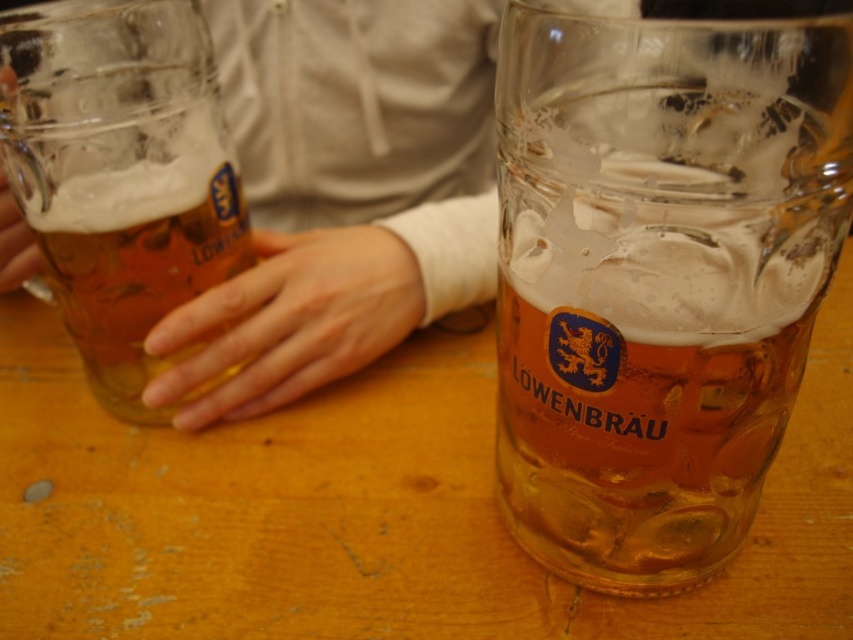
Question: Which object is farther from the camera taking this photo?

Choices:
 (A) matte skin hand at left
 (B) translucent glass mug at left
 (C) white fabric hand at center

Answer: (C)

Question: Considering the real-world distances, which object is closest to the smooth skin hand at center?

Choices:
 (A) matte skin hand at left
 (B) white fabric hand at center
 (C) translucent glass mug at right
 (D) translucent glass mug at left

Answer: (D)

Question: Which object appears farthest from the camera in this image?

Choices:
 (A) translucent glass mug at left
 (B) white fabric hand at center
 (C) smooth skin hand at center

Answer: (C)

Question: Is translucent glass mug at right below matte skin hand at left?

Choices:
 (A) yes
 (B) no

Answer: (A)

Question: Can you confirm if translucent glass mug at right is positioned below matte skin hand at left?

Choices:
 (A) no
 (B) yes

Answer: (B)

Question: Considering the relative positions of translucent glass mug at right and smooth skin hand at center in the image provided, where is translucent glass mug at right located with respect to smooth skin hand at center?

Choices:
 (A) right
 (B) left

Answer: (A)